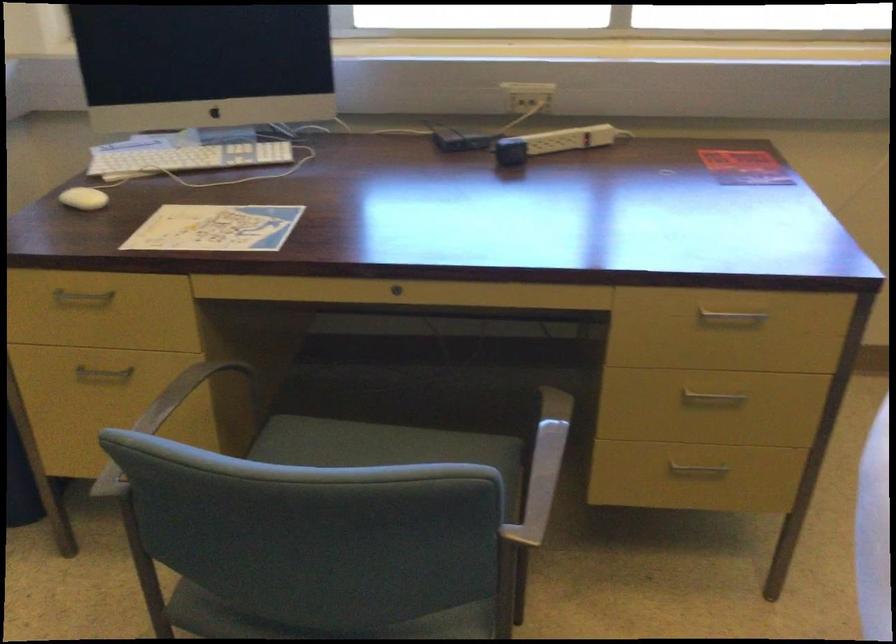
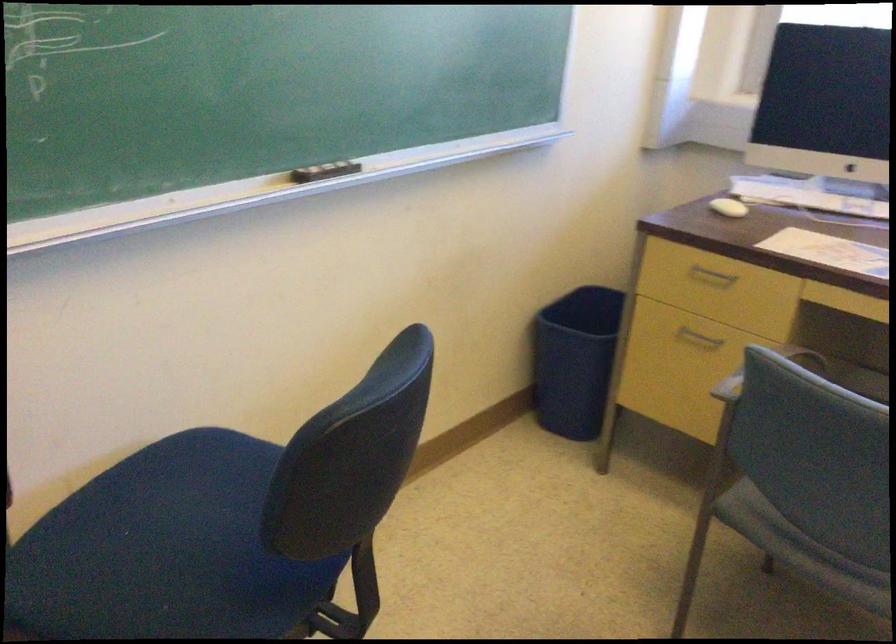
Where in the second image is the point corresponding to pixel 99 381 from the first image?

(698, 337)